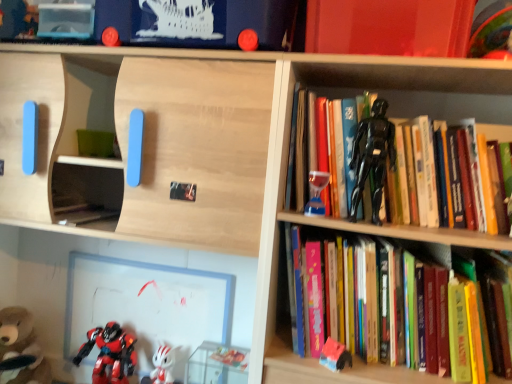
Question: Is brown plush bear at lower left, which appears as the 1th toy when viewed from the left, bigger or smaller than black glossy action figure at upper right, the sixth toy in the left-to-right sequence?

Choices:
 (A) big
 (B) small

Answer: (A)

Question: From the image's perspective, relative to black glossy action figure at upper right, the sixth toy in the left-to-right sequence, is brown plush bear at lower left, marked as the sixth toy in a right-to-left arrangement, above or below?

Choices:
 (A) above
 (B) below

Answer: (B)

Question: Estimate the real-world distances between objects in this image. Which object is farther from the wooden shelf at upper center, which is counted as the first shelf, starting from the front?

Choices:
 (A) brown plush bear at lower left, marked as the sixth toy in a right-to-left arrangement
 (B) translucent glass hourglass at upper right, positioned as the 3th toy in right-to-left order
 (C) rubberized plastic toy at lower right, which ranks as the second toy in right-to-left order
 (D) shiny red plastic robot at lower left, which ranks as the 2th toy in left-to-right order
 (E) black glossy action figure at upper right, the sixth toy in the left-to-right sequence

Answer: (C)

Question: Based on their relative distances, which object is farther from the brown plush bear at lower left, which appears as the 1th toy when viewed from the left?

Choices:
 (A) rubberized plastic toy at lower right, the 5th toy when ordered from left to right
 (B) black glossy action figure at upper right, the sixth toy in the left-to-right sequence
 (C) hardcover book at upper right, arranged as the 1th book when ordered from the bottom
 (D) black plastic action figure at upper right
 (E) wooden shelf at upper center, which is counted as the first shelf, starting from the front

Answer: (B)